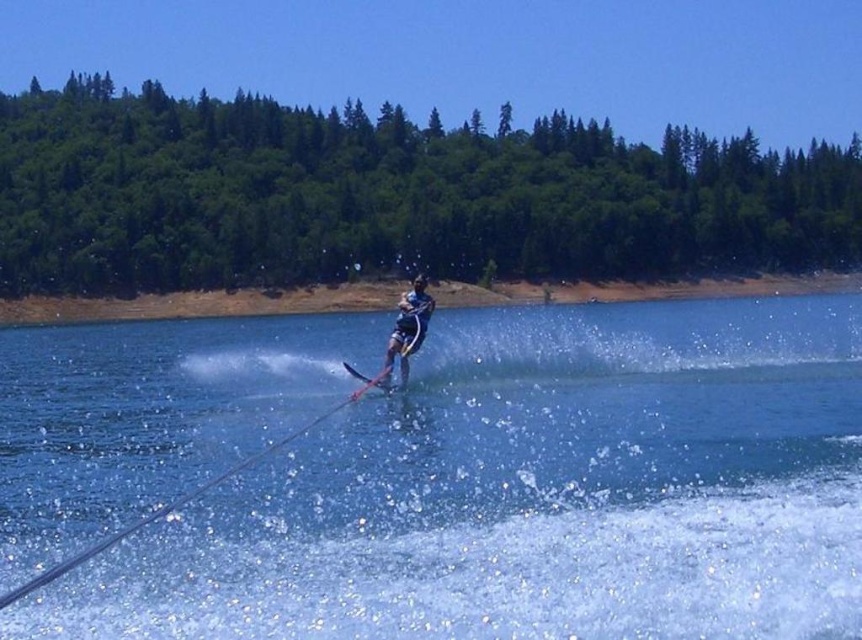
You are a photographer trying to capture the skier in the foreground while also including the green leafy trees at upper center in the background. Based on their positions, will the trees be visible in your photo if you focus on the skier?

The green leafy trees at upper center are located at point (388, 196), so they will be visible in the background when focusing on the skier in the foreground.

You are a photographer trying to capture the water skiing action. You notice the clear blue water at center and the green leafy trees at upper center in your viewfinder. Which object is positioned closer to you, the photographer?

The clear blue water at center is closer to the viewer than the green leafy trees at upper center, so the clear blue water at center is positioned closer to you, the photographer.